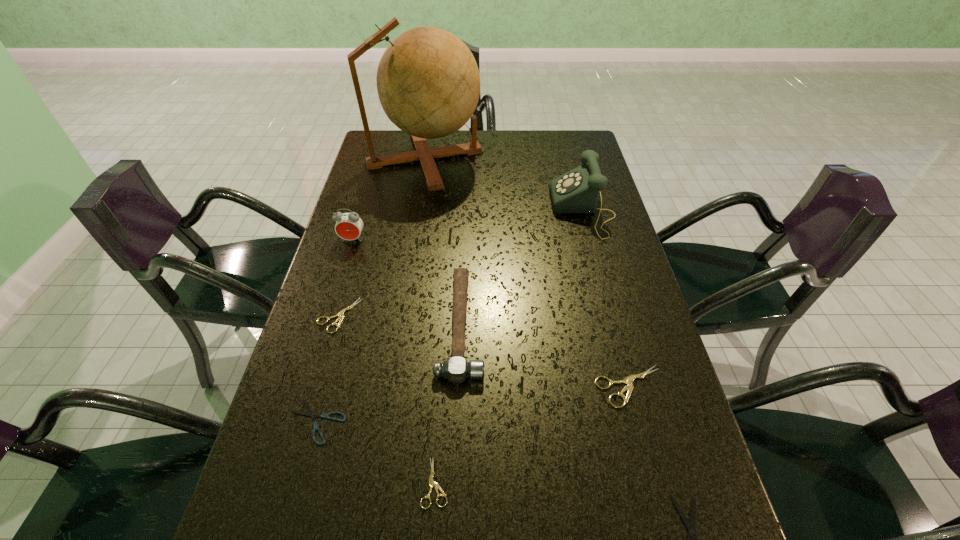
Find the location of a particular element. The height and width of the screenshot is (540, 960). vacant space at the far right corner of the desktop is located at coordinates (566, 136).

What are the coordinates of `empty location between the sixth shortest object and the second beige shears from left to right` in the screenshot? It's located at (448, 403).

Identify the location of vacant space that's between the third shears from left to right and the alarm clock. pyautogui.click(x=394, y=361).

In order to click on vacant region between the sixth shortest object and the alarm clock in this screenshot , I will do 407,282.

The width and height of the screenshot is (960, 540). In order to click on free space between the farther black shears and the globe in this screenshot , I will do (371, 289).

Locate an element on the screen. The height and width of the screenshot is (540, 960). free space between the third shears from right to left and the fifth tallest object is located at coordinates (533, 435).

Where is `free spot between the nearest beige shears and the red alarm clock`? free spot between the nearest beige shears and the red alarm clock is located at coordinates (394, 361).

Select which object appears as the fifth closest to the nearest beige shears. Please provide its 2D coordinates. Your answer should be formatted as a tuple, i.e. [(x, y)], where the tuple contains the x and y coordinates of a point satisfying the conditions above.

[(690, 526)]

Point out which object is positioned as the eighth nearest to the red alarm clock. Please provide its 2D coordinates. Your answer should be formatted as a tuple, i.e. [(x, y)], where the tuple contains the x and y coordinates of a point satisfying the conditions above.

[(690, 526)]

Where is `shears that is the third closest one to the fifth shortest object`? shears that is the third closest one to the fifth shortest object is located at coordinates (315, 427).